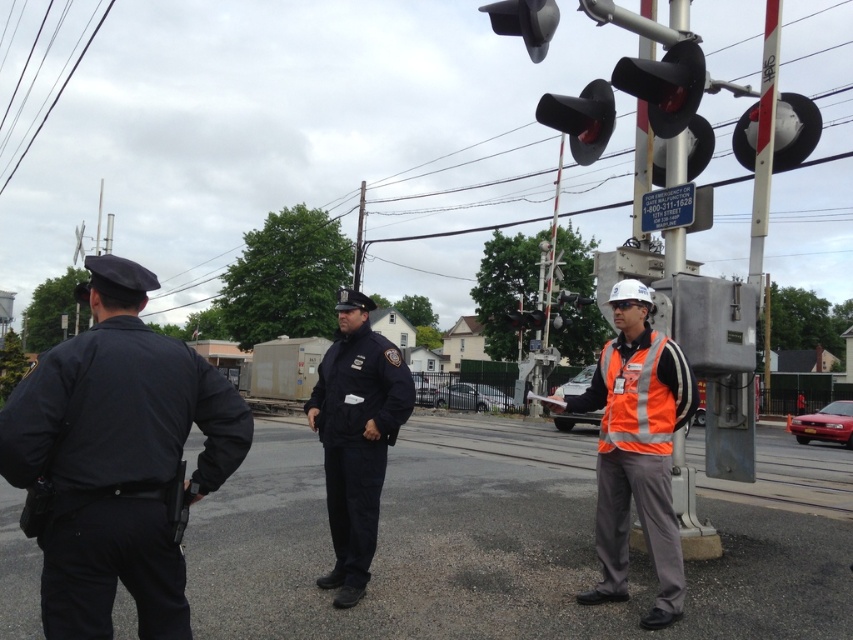
Between reflective orange vest at center and black rubber traffic light at upper center, which one appears on the left side from the viewer's perspective?

From the viewer's perspective, reflective orange vest at center appears more on the left side.

Between point (602, 353) and point (524, 29), which one is positioned in front?

Point (602, 353)

Image resolution: width=853 pixels, height=640 pixels. I want to click on reflective orange vest at center, so (x=636, y=449).

Identify the location of dark blue uniform at center. (357, 436).

Between dark blue uniform at center and black rubber traffic light at upper center, which one appears on the left side from the viewer's perspective?

Positioned to the left is dark blue uniform at center.

Identify the location of dark blue uniform at center. (357, 436).

Which of these two, reflective orange vest at center or black matte traffic light at upper center, stands shorter?

reflective orange vest at center

Does point (616, 413) come closer to viewer compared to point (582, 92)?

Yes, it is.

Locate an element on the screen. reflective orange vest at center is located at coordinates pos(636,449).